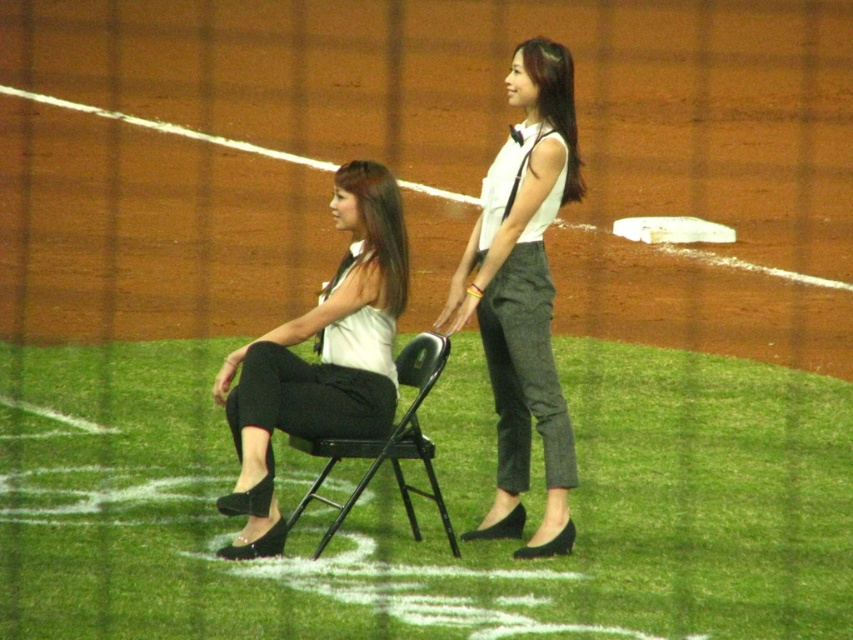
Question: Is matte black pants at center above black metal chair at center?

Choices:
 (A) no
 (B) yes

Answer: (B)

Question: Which point is farther to the camera?

Choices:
 (A) (x=368, y=448)
 (B) (x=544, y=412)
 (C) (x=236, y=410)

Answer: (B)

Question: Is white textured pants at center thinner than black metal chair at center?

Choices:
 (A) no
 (B) yes

Answer: (B)

Question: Where is white textured pants at center located in relation to matte black pants at center in the image?

Choices:
 (A) left
 (B) right

Answer: (B)

Question: Which point is closer to the camera?

Choices:
 (A) matte black pants at center
 (B) white textured pants at center
 (C) black metal chair at center

Answer: (A)

Question: Which of these objects is positioned farthest from the matte black pants at center?

Choices:
 (A) white textured pants at center
 (B) black metal chair at center

Answer: (A)